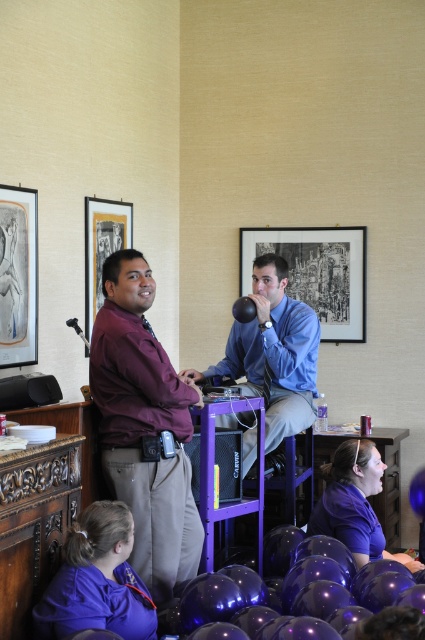
Question: Which of the following is the farthest from the observer?

Choices:
 (A) (399, 486)
 (B) (263, 433)
 (C) (25, 204)
 (D) (102, 221)

Answer: (A)

Question: Does maroon shirt at center have a larger size compared to shiny purple balloon at lower center?

Choices:
 (A) yes
 (B) no

Answer: (B)

Question: Can you confirm if purple plastic table at center is positioned above purple glossy table at lower center?

Choices:
 (A) no
 (B) yes

Answer: (B)

Question: Which point is farther from the camera taking this photo?

Choices:
 (A) coord(150,344)
 (B) coord(68,323)
 (C) coord(243,253)

Answer: (C)

Question: Observing the image, what is the correct spatial positioning of maroon shirt at center in reference to glossy purple balloon at lower center?

Choices:
 (A) below
 (B) above

Answer: (B)

Question: Which object is closer to the camera taking this photo?

Choices:
 (A) purple matte shirt at lower left
 (B) blue fabric shirt at center
 (C) shiny purple balloon at lower center
 (D) purple plastic table at center

Answer: (A)